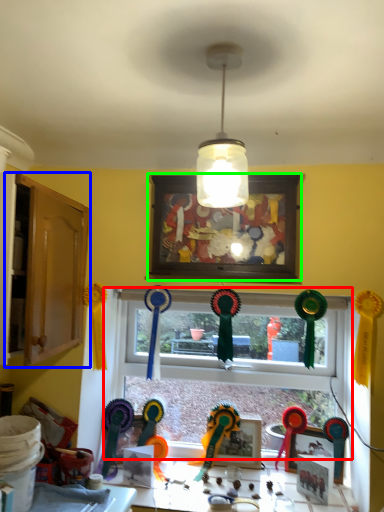
Question: Estimate the real-world distances between objects in this image. Which object is farther from window (highlighted by a red box), dresser (highlighted by a blue box) or picture frame (highlighted by a green box)?

Choices:
 (A) dresser
 (B) picture frame

Answer: (A)